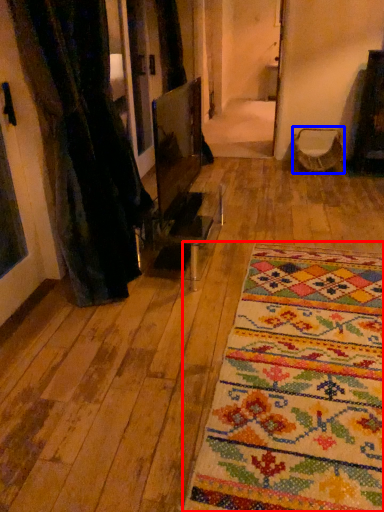
Question: Which point is closer to the camera, mat (highlighted by a red box) or armchair (highlighted by a blue box)?

Choices:
 (A) mat
 (B) armchair

Answer: (A)